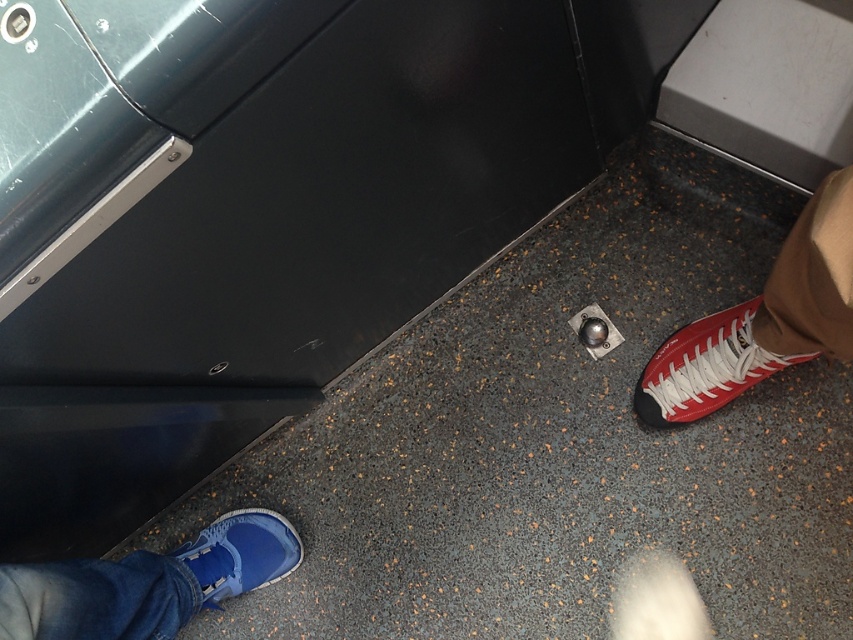
From the picture: Between blue suede shoe at lower left and red leather sneaker at lower right, which one appears on the left side from the viewer's perspective?

From the viewer's perspective, blue suede shoe at lower left appears more on the left side.

Which is in front, point (12, 579) or point (682, 333)?

Point (12, 579)

Identify the location of blue suede shoe at lower left. The width and height of the screenshot is (853, 640). (148, 582).

Image resolution: width=853 pixels, height=640 pixels. I want to click on red leather shoe at lower right, so click(762, 320).

Between blue suede shoe at lower left and matte blue sneaker at lower left, which one is positioned lower?

matte blue sneaker at lower left

Can you confirm if blue suede shoe at lower left is shorter than matte blue sneaker at lower left?

No, blue suede shoe at lower left is not shorter than matte blue sneaker at lower left.

Between point (247, 547) and point (222, 534), which one is positioned in front?

Point (247, 547) is more forward.

Find the location of a particular element. The width and height of the screenshot is (853, 640). blue suede shoe at lower left is located at coordinates (148, 582).